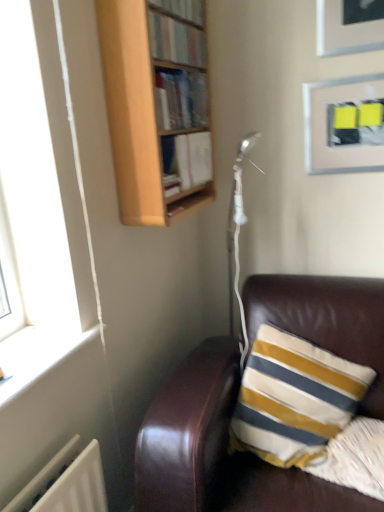
Question: Is striped fabric pillow at lower right bigger or smaller than brown leather couch at lower right?

Choices:
 (A) small
 (B) big

Answer: (A)

Question: Is striped fabric pillow at lower right spatially inside brown leather couch at lower right, or outside of it?

Choices:
 (A) outside
 (B) inside

Answer: (B)

Question: Which of these objects is positioned closest to the striped fabric pillow at lower right?

Choices:
 (A) wooden bookcase at upper center
 (B) wooden bookshelf at upper center, which appears as the 2th book when viewed from the top
 (C) wooden bookshelf at upper center, the first book positioned from the top
 (D) hardcover book at upper center, the first book when ordered from bottom to top
 (E) metallic silver picture frame at upper right

Answer: (D)

Question: Which of these objects is positioned closest to the metallic silver picture frame at upper right?

Choices:
 (A) wooden bookcase at upper center
 (B) striped fabric pillow at lower right
 (C) brown leather couch at lower right
 (D) hardcover book at upper center, the first book when ordered from bottom to top
 (E) wooden bookshelf at upper center, the third book positioned from the bottom

Answer: (D)